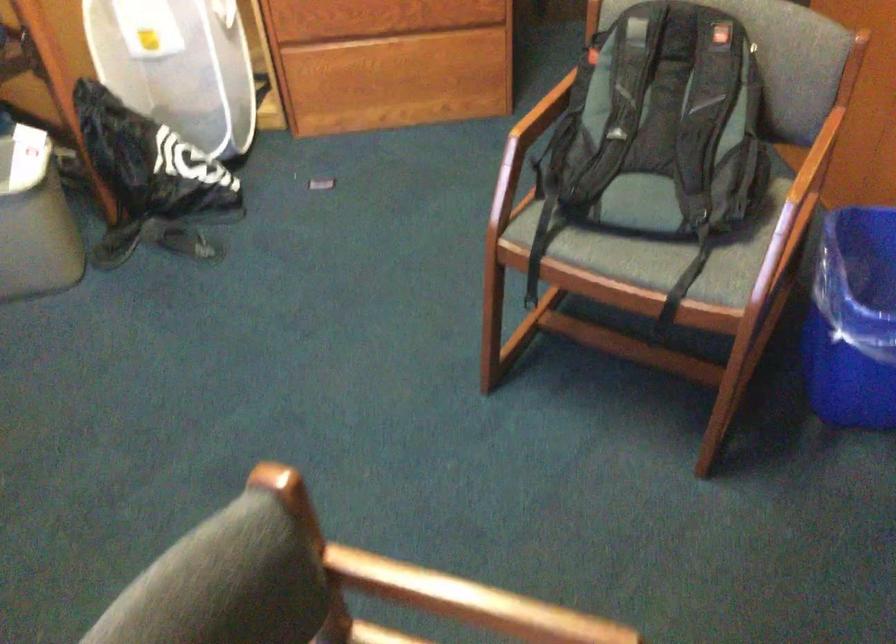
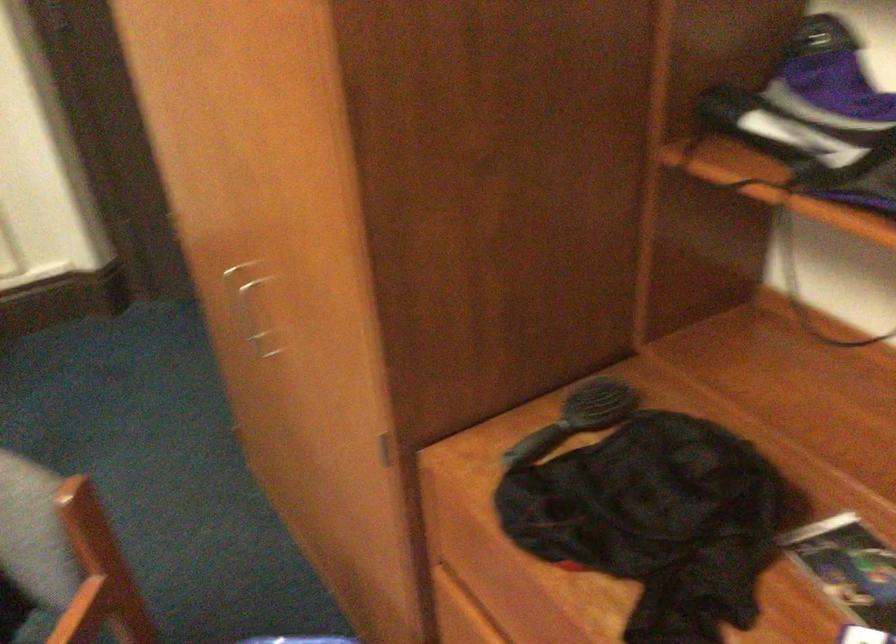
Question: The images are taken continuously from a first-person perspective. In which direction is your viewpoint rotating?

Choices:
 (A) Left
 (B) Right
 (C) Up
 (D) Down

Answer: (B)